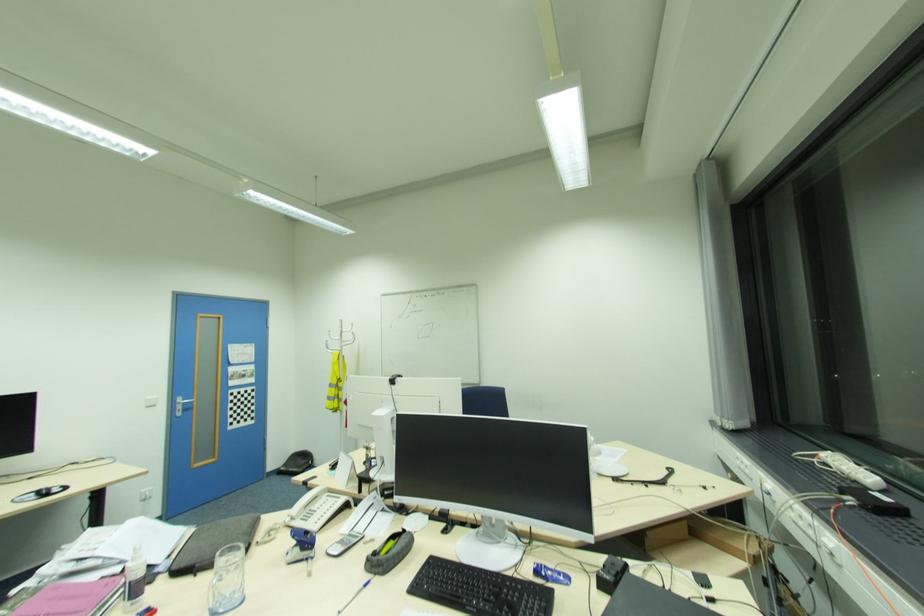
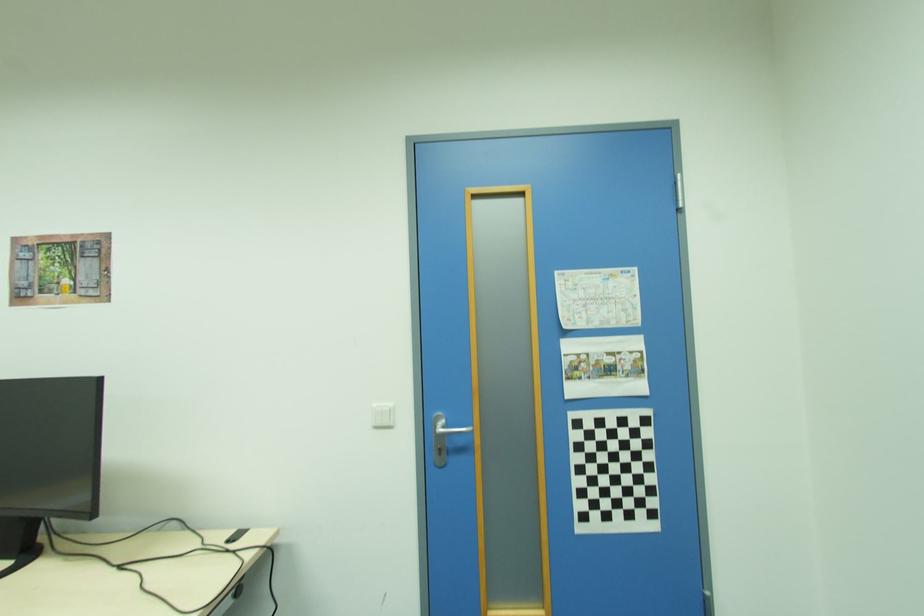
Find the pixel in the second image that matches the point at 242,362 in the first image.

(599, 325)